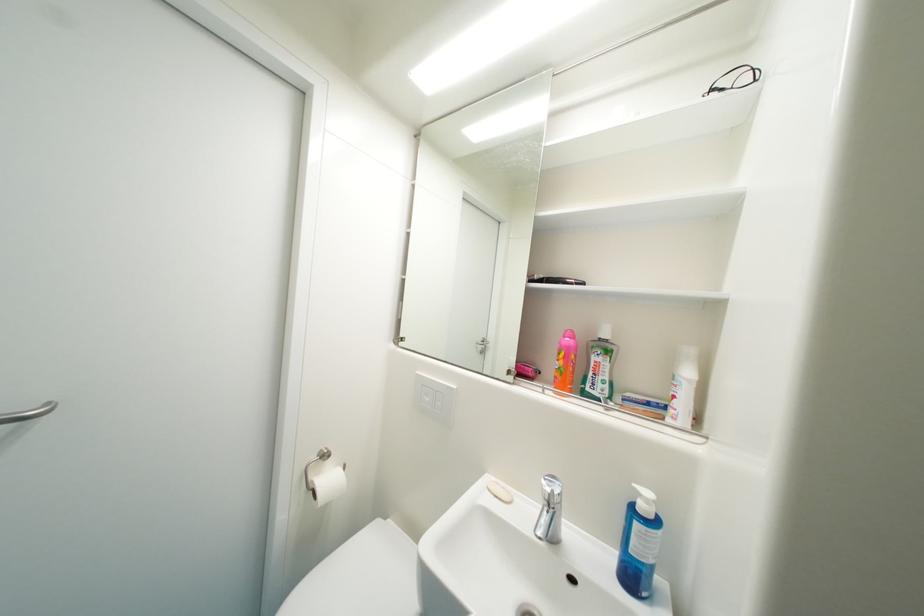
Identify the location of white toilet lid. (367, 581).